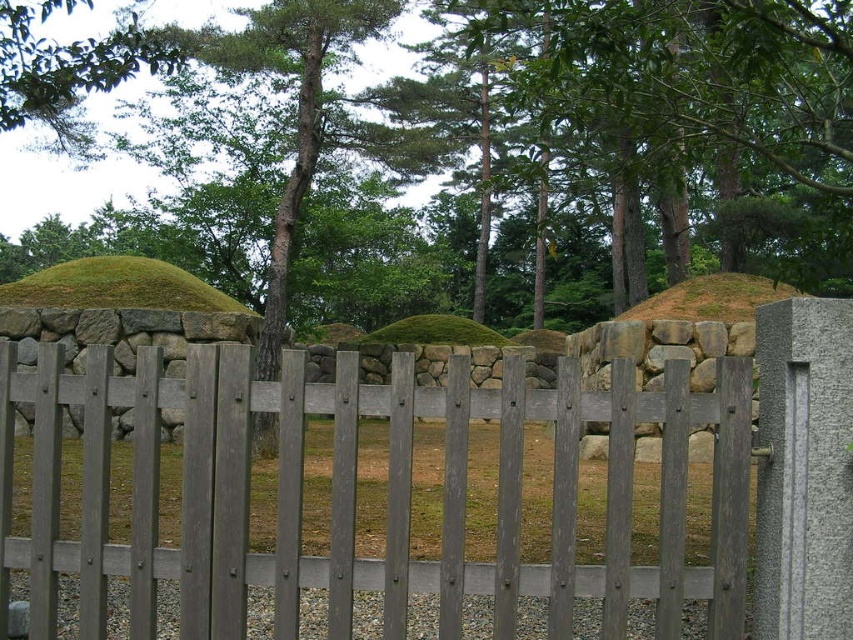
Question: Which is farther from the green grass at center?

Choices:
 (A) green mossy mound at center
 (B) gray wood fence at center
 (C) green moss-covered mound at left

Answer: (A)

Question: Is the position of green grass at center more distant than that of green mossy mound at center?

Choices:
 (A) yes
 (B) no

Answer: (B)

Question: Among these objects, which one is nearest to the camera?

Choices:
 (A) gray wood fence at center
 (B) green grass at center
 (C) green moss-covered mound at left
 (D) green mossy mound at center

Answer: (A)

Question: Can you confirm if green grass at center is wider than green moss-covered mound at left?

Choices:
 (A) yes
 (B) no

Answer: (A)

Question: Which object is the farthest from the gray wood fence at center?

Choices:
 (A) green mossy mound at center
 (B) green moss-covered mound at left

Answer: (A)

Question: Is gray wood fence at center below green moss-covered mound at left?

Choices:
 (A) yes
 (B) no

Answer: (A)